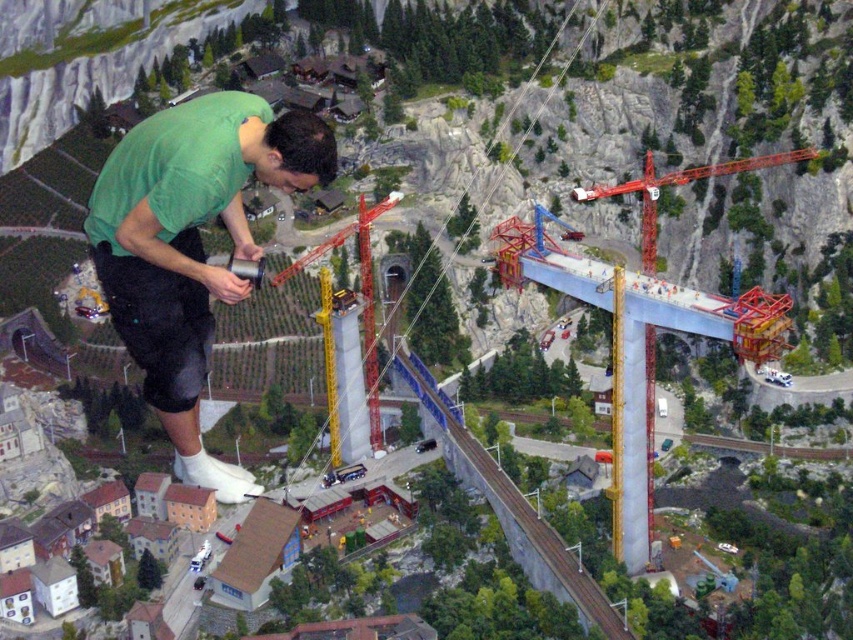
Who is more distant from viewer, (119,177) or (331,388)?

The point (331,388) is more distant.

Is green matte shirt at upper left to the right of yellow metallic crane at center from the viewer's perspective?

No, green matte shirt at upper left is not to the right of yellow metallic crane at center.

Between point (173, 282) and point (368, 396), which one is positioned in front?

Point (173, 282) is more forward.

Locate an element on the screen. green matte shirt at upper left is located at coordinates (190, 244).

Can you confirm if green matte shirt at upper left is taller than orange metallic crane at upper right?

Incorrect, green matte shirt at upper left's height is not larger of orange metallic crane at upper right's.

Locate an element on the screen. This screenshot has width=853, height=640. green matte shirt at upper left is located at coordinates (190, 244).

Where is `green matte shirt at upper left`? This screenshot has height=640, width=853. green matte shirt at upper left is located at coordinates (190, 244).

Does orange metallic crane at upper right appear over yellow metallic crane at center?

Yes, orange metallic crane at upper right is above yellow metallic crane at center.

Identify the location of orange metallic crane at upper right. This screenshot has width=853, height=640. (677, 184).